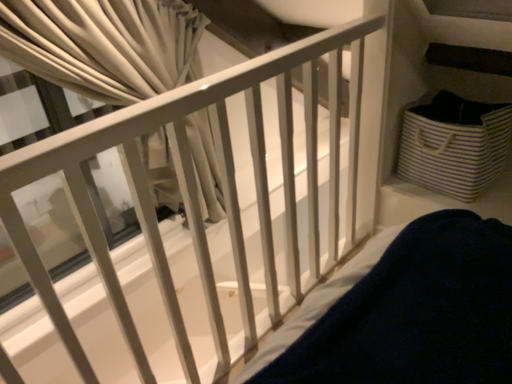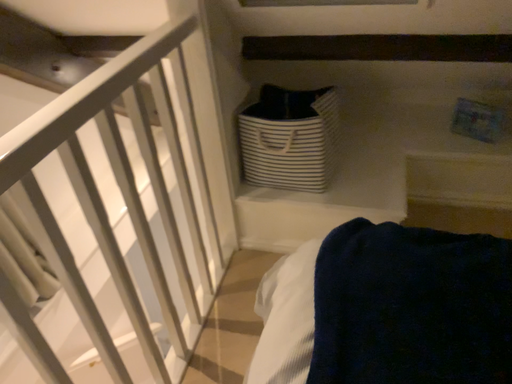
Question: How did the camera likely rotate when shooting the video?

Choices:
 (A) rotated left
 (B) rotated right

Answer: (B)